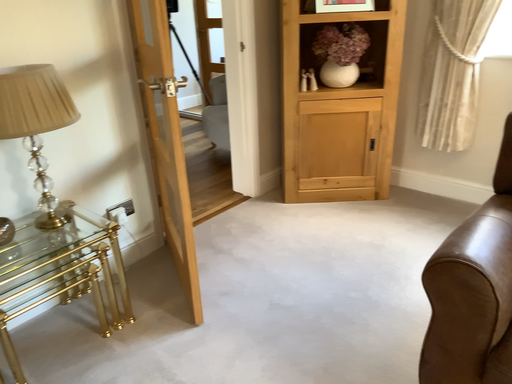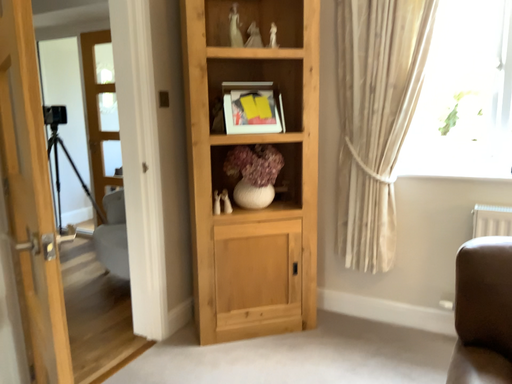
Question: How did the camera likely rotate when shooting the video?

Choices:
 (A) rotated left
 (B) rotated right

Answer: (B)